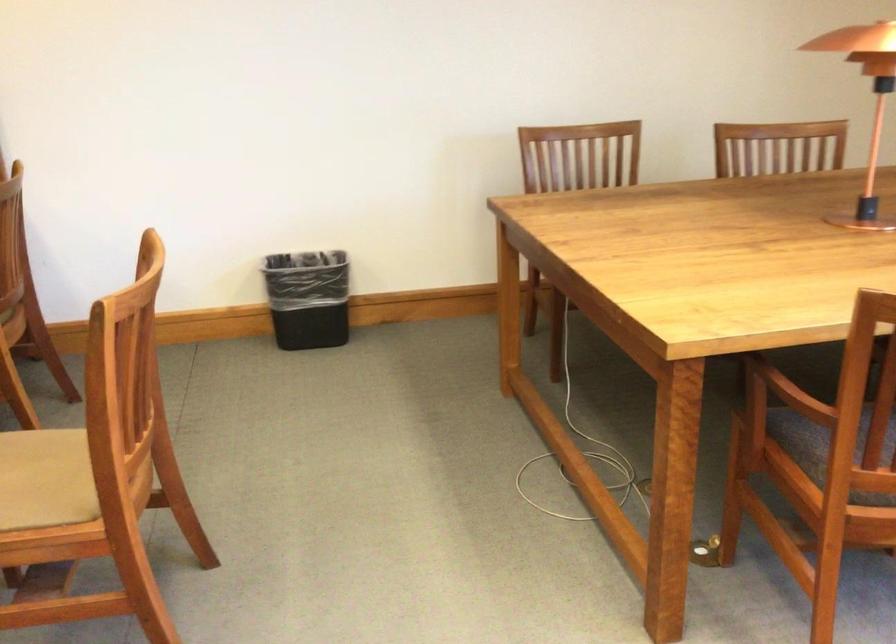
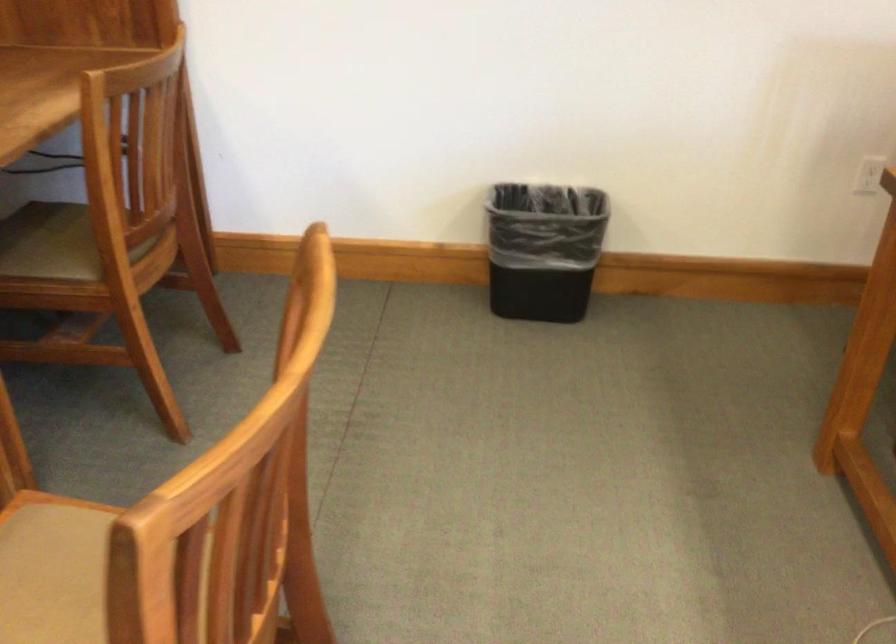
Question: The camera is either moving clockwise (left) or counter-clockwise (right) around the object. The first image is from the beginning of the video and the second image is from the end. Is the camera moving left or right when shooting the video?

Choices:
 (A) Left
 (B) Right

Answer: (B)